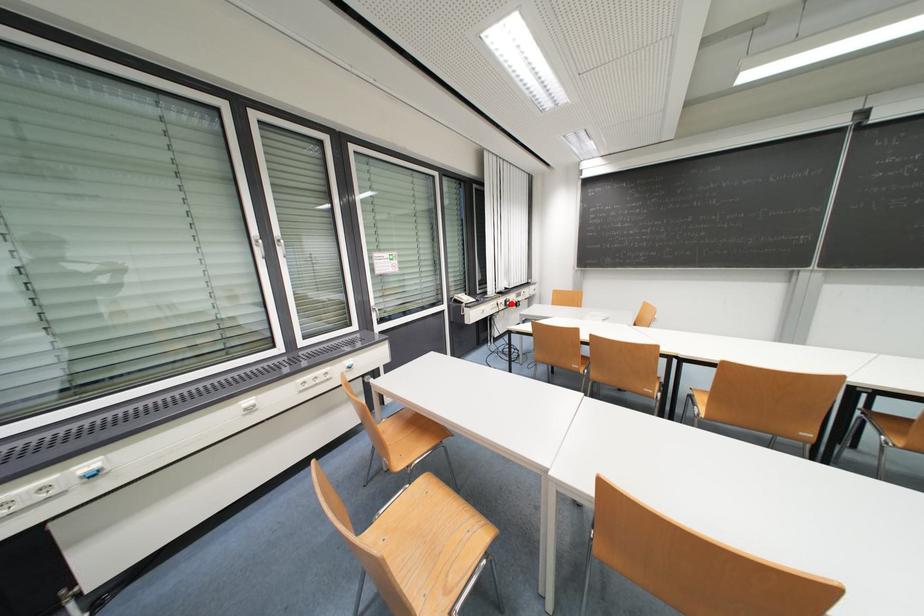
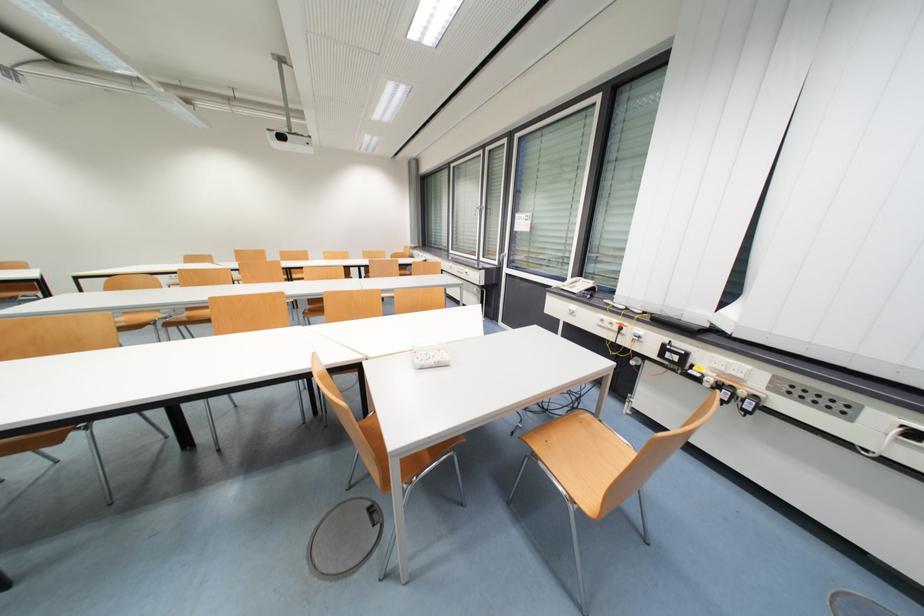
In the second image, find the point that corresponds to the highlighted location in the first image.

(671, 350)